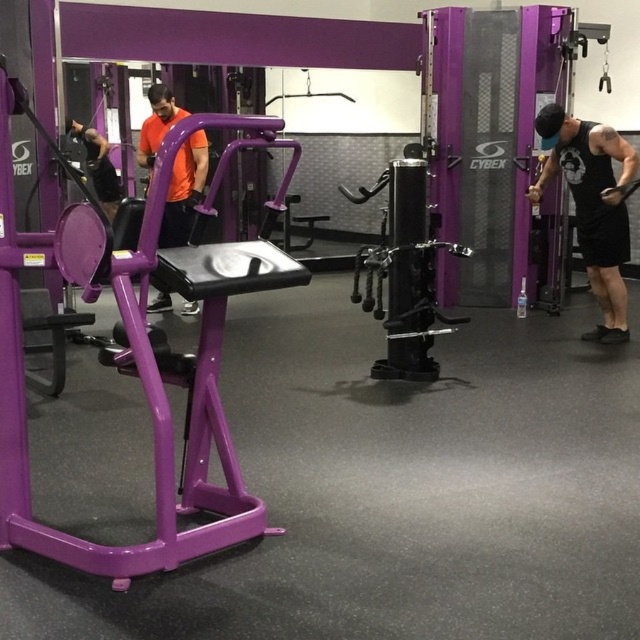
Between point (582, 124) and point (188, 308), which one is positioned in front?

Point (582, 124) is more forward.

Can you confirm if black matte tank top at right is thinner than orange fabric shirt at center?

No.

What do you see at coordinates (593, 205) in the screenshot?
I see `black matte tank top at right` at bounding box center [593, 205].

You are a GUI agent. You are given a task and a screenshot of the screen. Output one action in this format:
    pyautogui.click(x=<x>, y=<y>)
    Task: Click on the black matte tank top at right
    
    Given the screenshot: What is the action you would take?
    pyautogui.click(x=593, y=205)